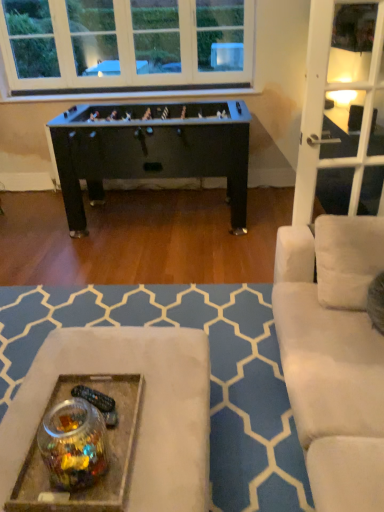
You are a GUI agent. You are given a task and a screenshot of the screen. Output one action in this format:
    pyautogui.click(x=<x>, y=<y>)
    Task: Click on the free space above metallic tray at lower center (from a real-world perspective)
    The image size is (384, 512).
    Given the screenshot: What is the action you would take?
    pyautogui.click(x=91, y=435)